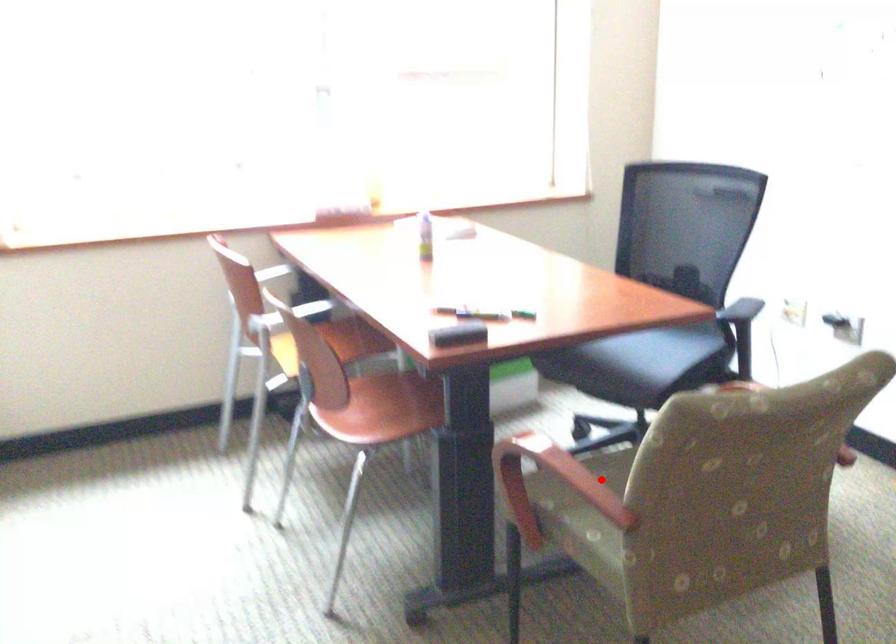
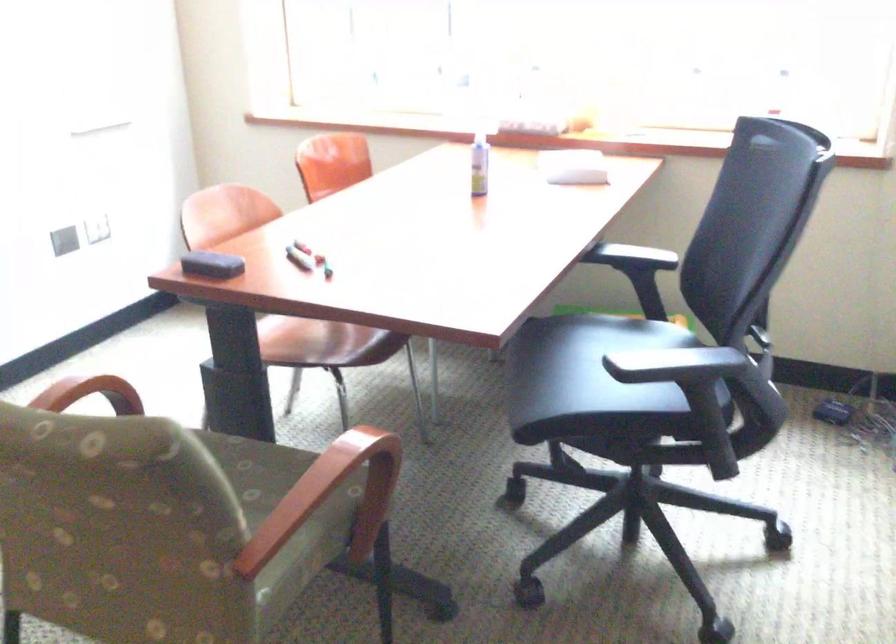
Question: I am providing you with two images of the same scene from different viewpoints. Given a red point in image1, look at the same physical point in image2. Is it:

Choices:
 (A) Closer to the viewpoint
 (B) Farther from the viewpoint

Answer: (A)